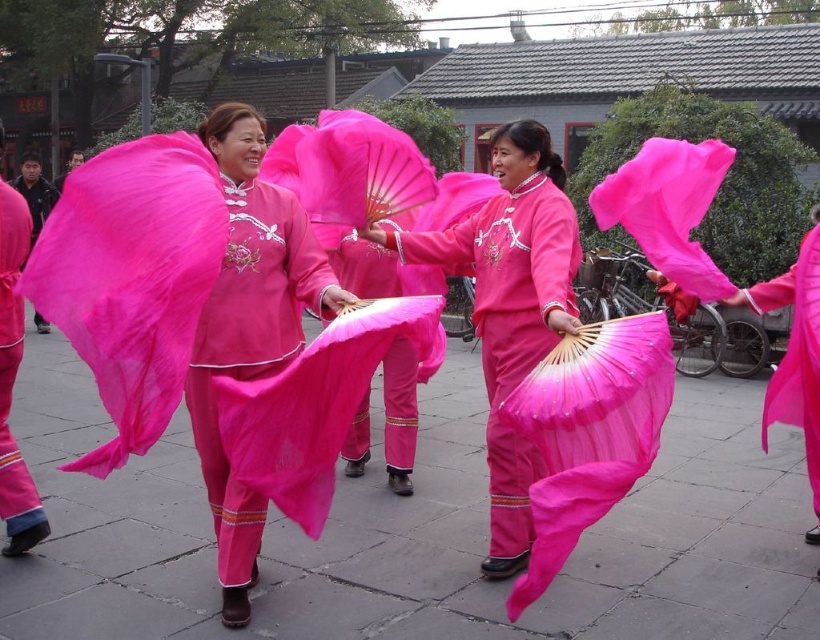
You are standing in the public square and want to take a photo of the point at coordinates [108,275]. The camera you are using has a focal length of 50mm and a sensor size of 24mm. Can you estimate if the point is within the camera sensor range?

The point at coordinates [108,275] is 2.84 meters away from the camera. With a focal length of 50mm and a sensor size of 24mm, the camera can capture objects within a certain distance. However, the exact sensor range calculation requires knowing the field of view, which depends on both focal length and sensor size. Since the point is 2.84 meters away, and assuming standard camera parameters, it is likely within the sensor range as the distance is not excessively far. Therefore, the point should be within

You are a photographer trying to capture the entire scene in one shot. You notice two areas with matte pink fabric at center and matte pink fabric pants at lower left. Which area should you focus on to ensure the wider matte pink fabric is included in your photo?

You should focus on the matte pink fabric at center because its width surpasses that of the matte pink fabric pants at lower left, making it the wider option to include in your photo.